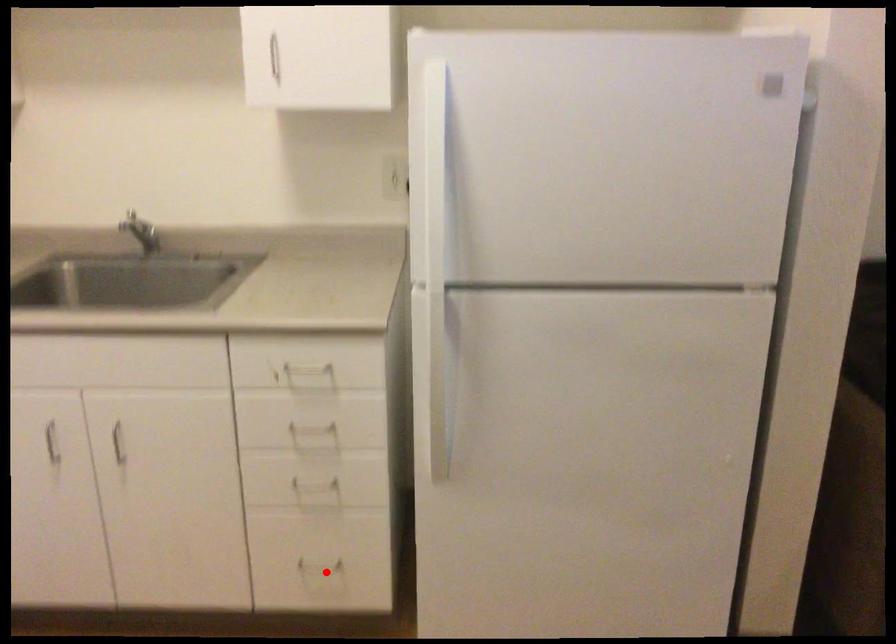
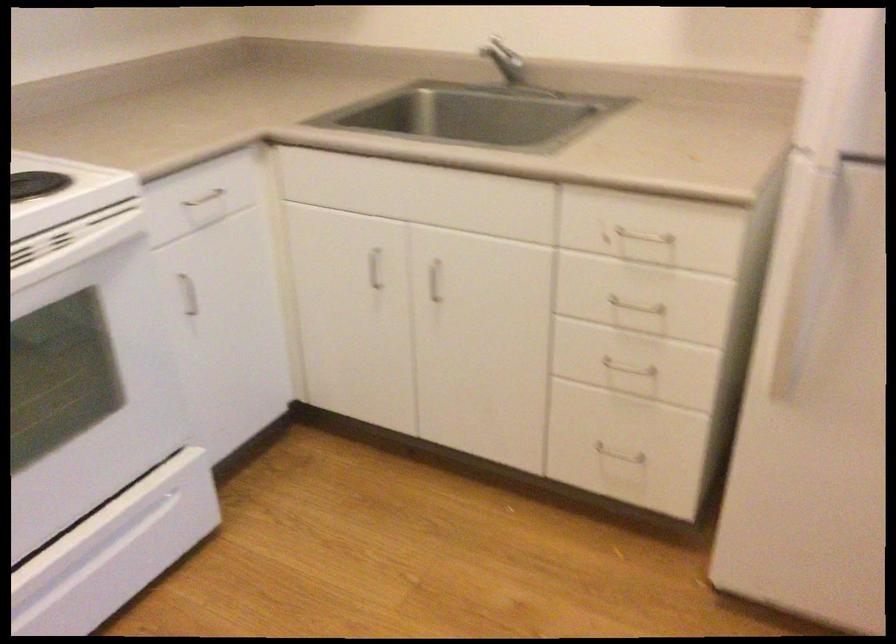
Question: I am providing you with two images of the same scene from different viewpoints. Image1 has a red point marked. In image2, the corresponding 3D location appears at what relative position? Reply with the corresponding letter.

Choices:
 (A) Closer
 (B) Farther

Answer: (A)